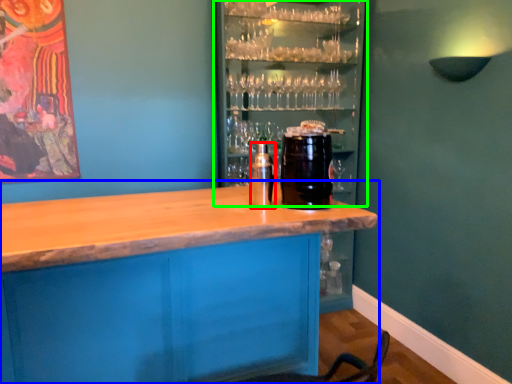
Question: Which object is positioned closest to beverage (highlighted by a red box)? Select from table (highlighted by a blue box) and shelf (highlighted by a green box).

Choices:
 (A) table
 (B) shelf

Answer: (A)